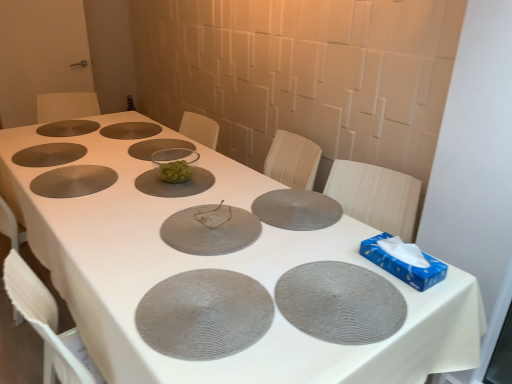
Identify the location of unoccupied space behind matte gray glass plate at center, which ranks as the eighth glass plate in back-to-front order. (210, 188).